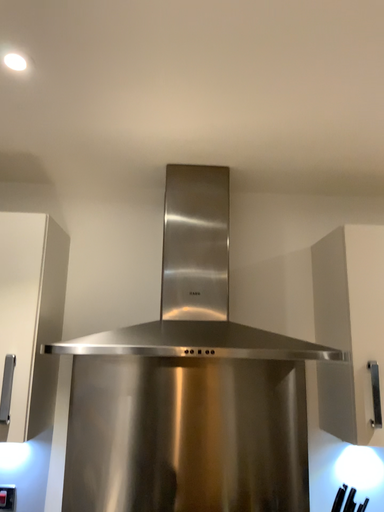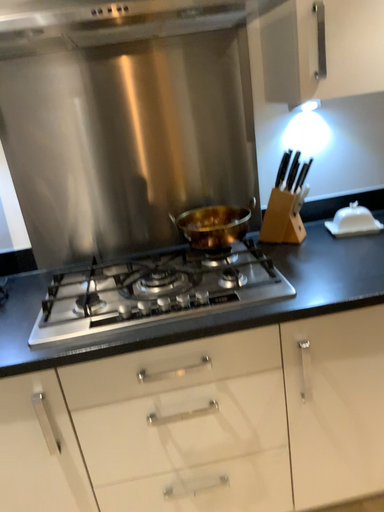
Question: How did the camera likely rotate when shooting the video?

Choices:
 (A) rotated upward
 (B) rotated downward

Answer: (B)